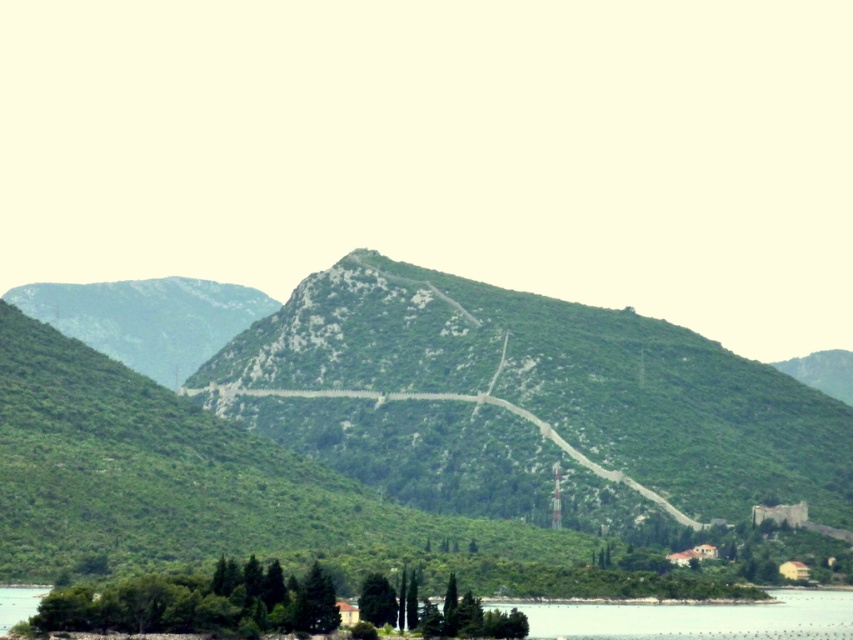
Question: Does green textured hill at center appear over green stone path at center?

Choices:
 (A) no
 (B) yes

Answer: (B)

Question: Observing the image, what is the correct spatial positioning of green textured hill at center in reference to green stone path at center?

Choices:
 (A) above
 (B) below

Answer: (A)

Question: Which object is farther from the camera taking this photo?

Choices:
 (A) green stone path at center
 (B) green textured hill at center

Answer: (A)

Question: Can you confirm if green textured hill at center is positioned below green stone path at center?

Choices:
 (A) no
 (B) yes

Answer: (A)